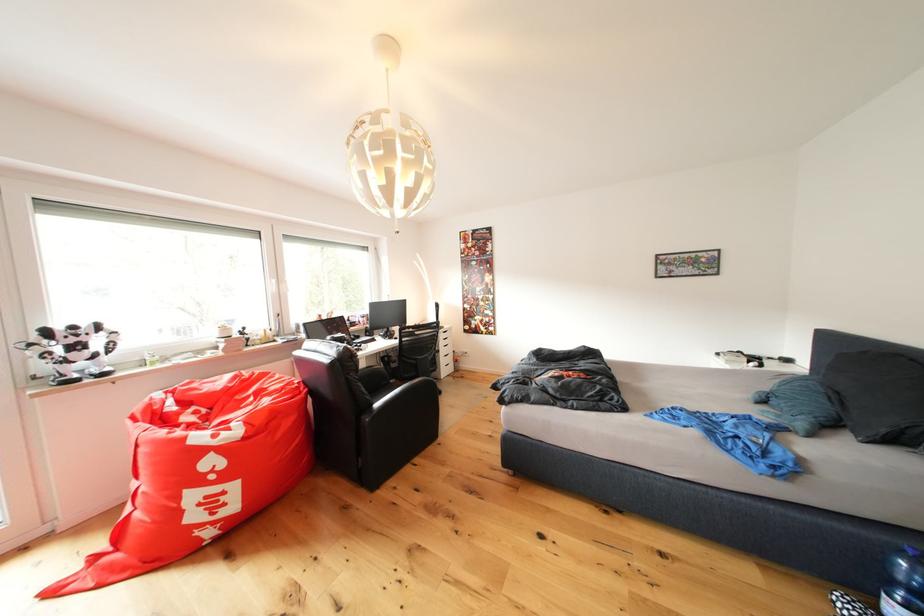
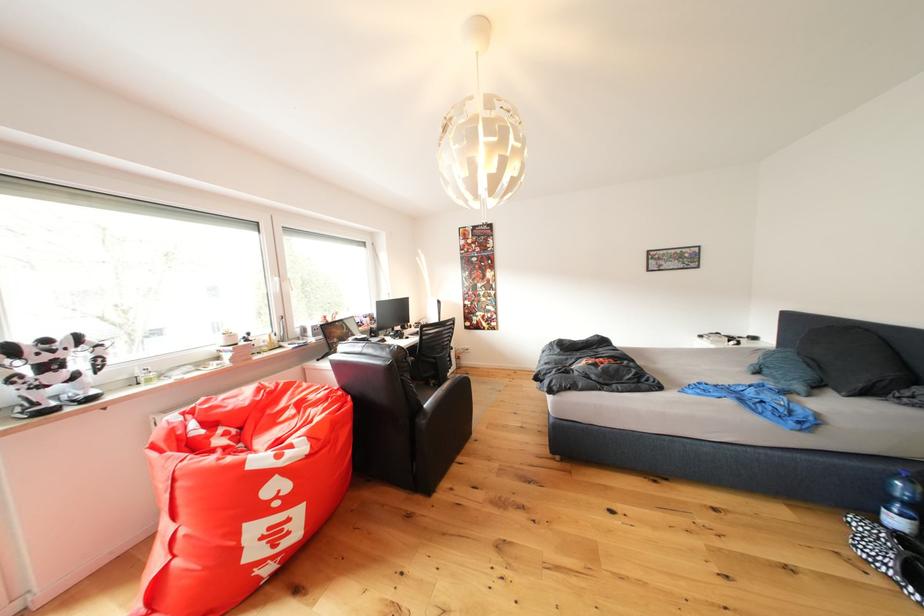
Find the pixel in the second image that matches (x=385, y=410) in the first image.

(434, 410)